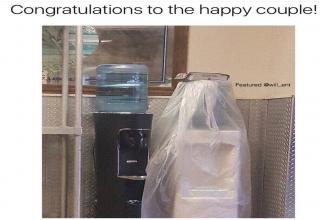
The image size is (320, 220). Identify the location of white dispenser. (207, 162).